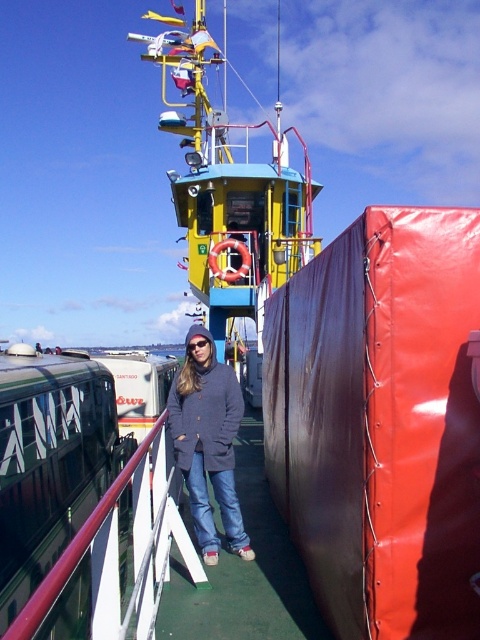
You are a photographer trying to capture a clear shot of the matte blue jacket at center and the metallic red railing at center. Based on their sizes, which object will appear more prominent in your photo?

The matte blue jacket at center is larger in size than the metallic red railing at center, so it will appear more prominent in the photo.

You are standing on the ferry deck and want to take a photo of the matte blue jacket at center. If your camera can focus on objects up to 5 meters away, will it be able to capture the jacket clearly?

The matte blue jacket at center is 5.34 meters away from the camera, which exceeds the camera focus limit of 5 meters. Therefore, the camera cannot capture the jacket clearly.